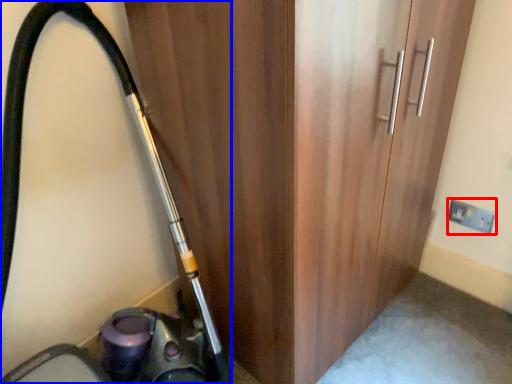
Question: Among these objects, which one is nearest to the camera, electric outlet (highlighted by a red box) or equipment (highlighted by a blue box)?

Choices:
 (A) electric outlet
 (B) equipment

Answer: (B)